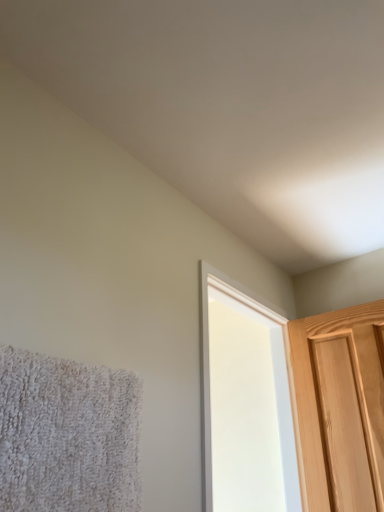
The width and height of the screenshot is (384, 512). Describe the element at coordinates (67, 435) in the screenshot. I see `white fluffy bath towel at lower left` at that location.

Locate an element on the screen. white fluffy bath towel at lower left is located at coordinates (67, 435).

What is the approximate height of white fluffy bath towel at lower left?

The height of white fluffy bath towel at lower left is 34.88 centimeters.

You are a GUI agent. You are given a task and a screenshot of the screen. Output one action in this format:
    pyautogui.click(x=<x>, y=<y>)
    Task: Click on the white fluffy bath towel at lower left
    The height and width of the screenshot is (512, 384).
    Given the screenshot: What is the action you would take?
    pyautogui.click(x=67, y=435)